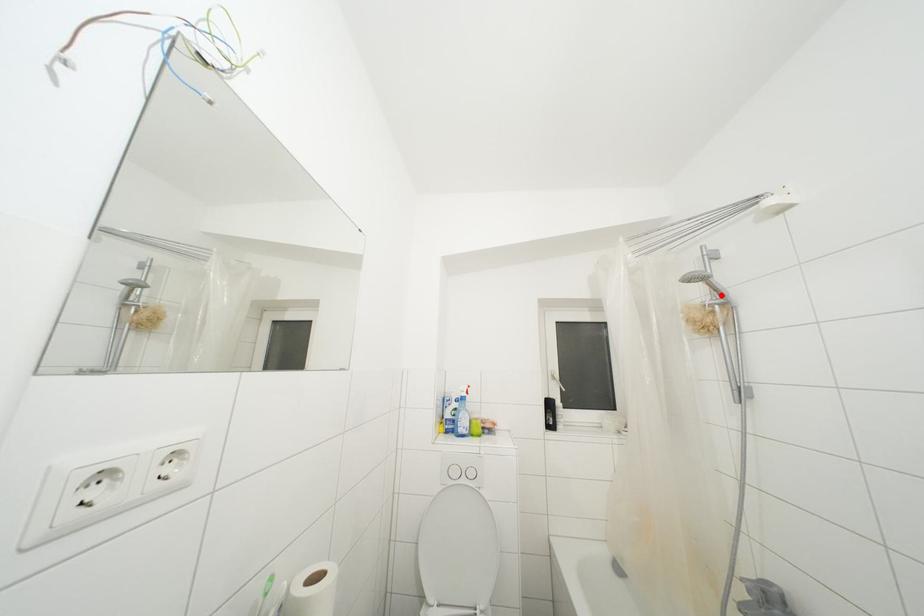
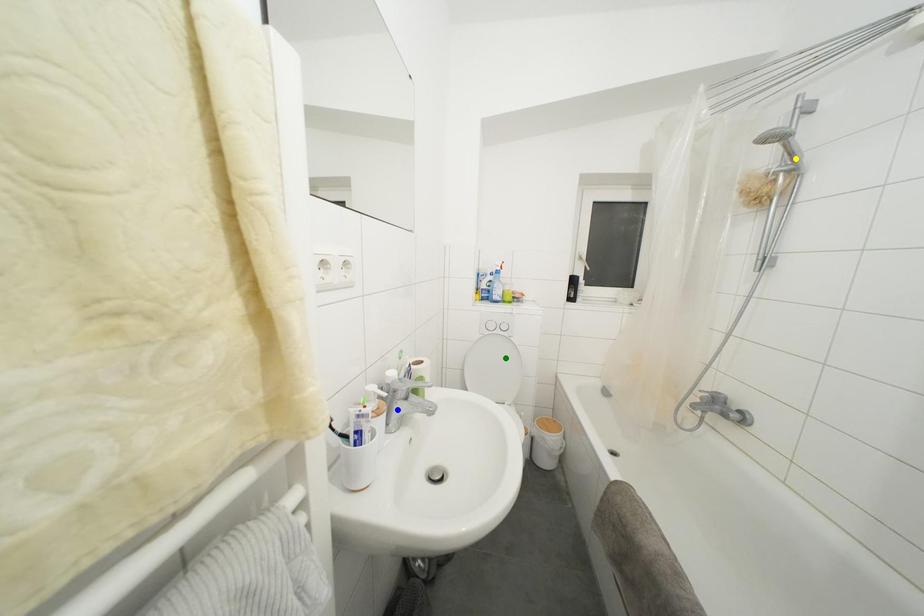
Question: I am providing you with two images of the same scene from different viewpoints. A red point is marked on the first image. You are given multiple points on the second image. In image 2, which mark is for the same physical point as the one in image 1?

Choices:
 (A) yellow point
 (B) blue point
 (C) green point

Answer: (A)